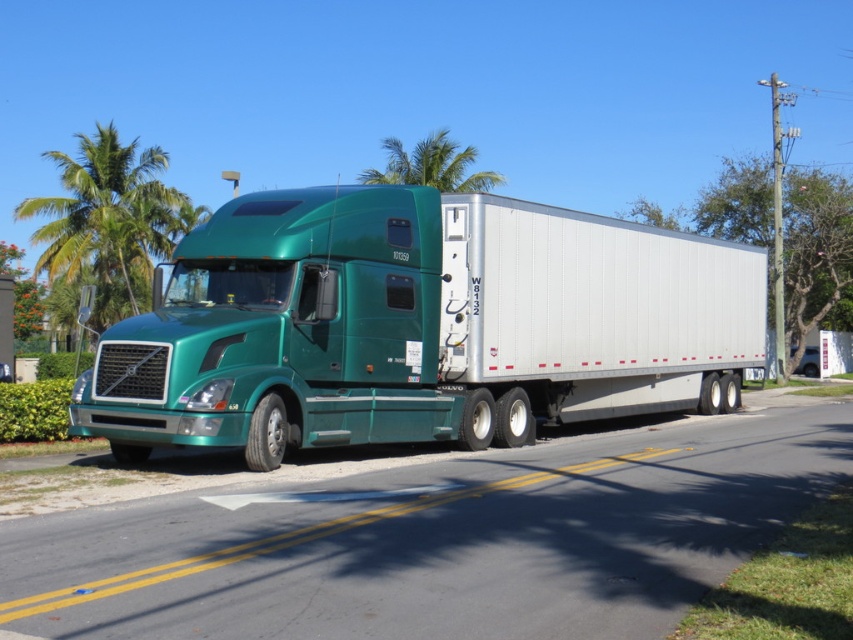
Does green metallic truck at center appear under green leafy palm tree at upper center?

Yes.

Does point (408, 221) lie behind point (479, 188)?

No, (408, 221) is in front of (479, 188).

Where is `green metallic truck at center`? This screenshot has height=640, width=853. green metallic truck at center is located at coordinates (419, 324).

What do you see at coordinates (109, 220) in the screenshot? The image size is (853, 640). I see `green leafy palm tree at upper left` at bounding box center [109, 220].

Is point (181, 234) in front of point (451, 179)?

That is False.

This screenshot has width=853, height=640. What do you see at coordinates (109, 220) in the screenshot?
I see `green leafy palm tree at upper left` at bounding box center [109, 220].

Where is `green leafy palm tree at upper left`? Image resolution: width=853 pixels, height=640 pixels. green leafy palm tree at upper left is located at coordinates (109, 220).

Does green metallic truck at center lie behind green leafy palm tree at upper left?

No.

Which is below, green metallic truck at center or green leafy palm tree at upper left?

green metallic truck at center is below.

The width and height of the screenshot is (853, 640). In order to click on green metallic truck at center in this screenshot , I will do pos(419,324).